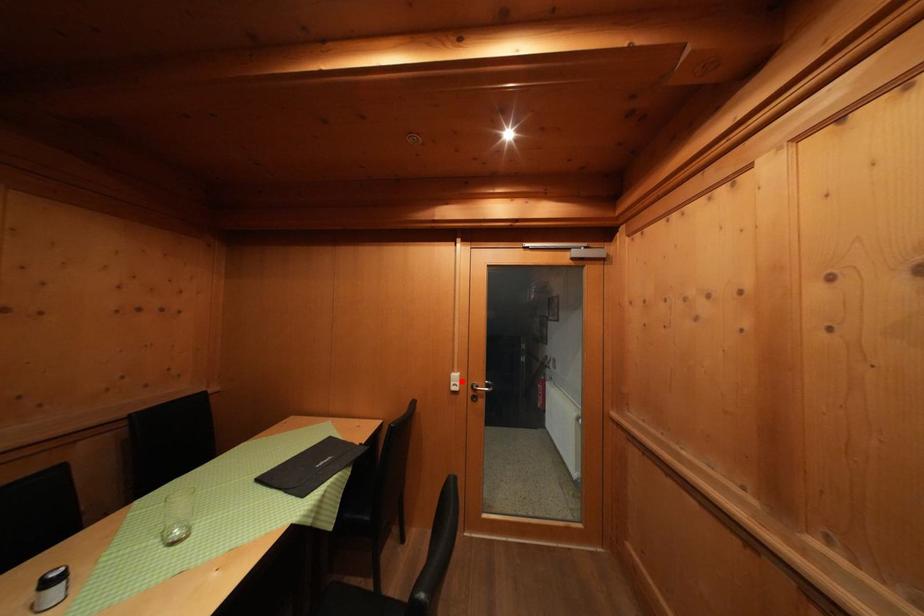
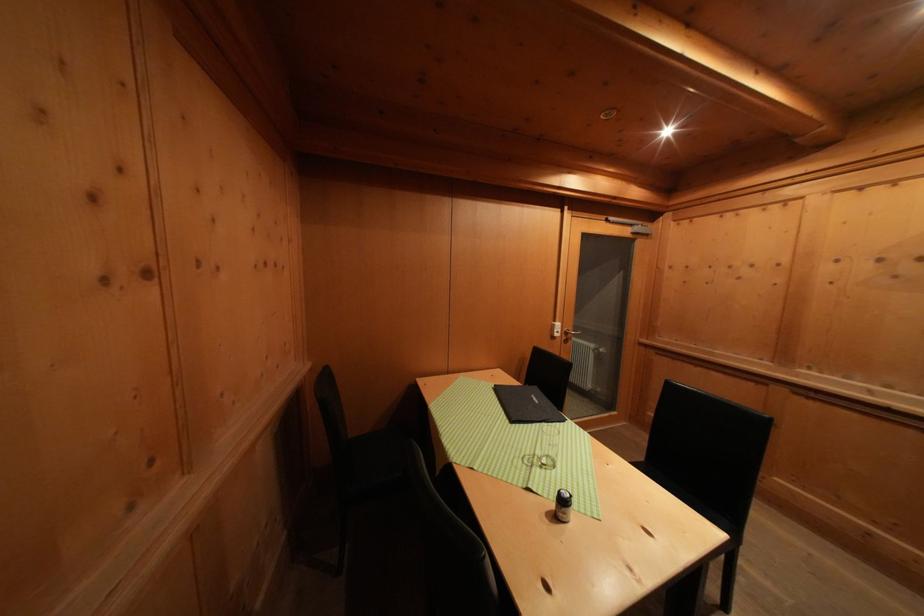
The point at the highlighted location is marked in the first image. Where is the corresponding point in the second image?

(564, 330)